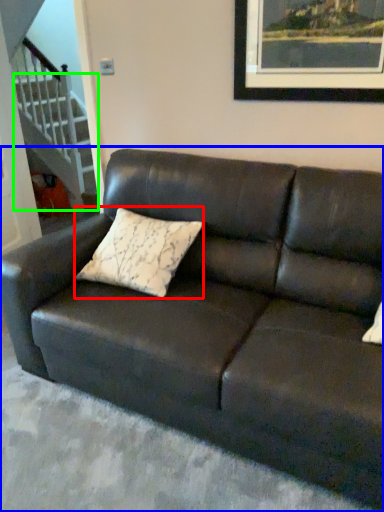
Question: Which object is the farthest from pillow (highlighted by a red box)? Choose among these: studio couch (highlighted by a blue box) or stairwell (highlighted by a green box).

Choices:
 (A) studio couch
 (B) stairwell

Answer: (B)